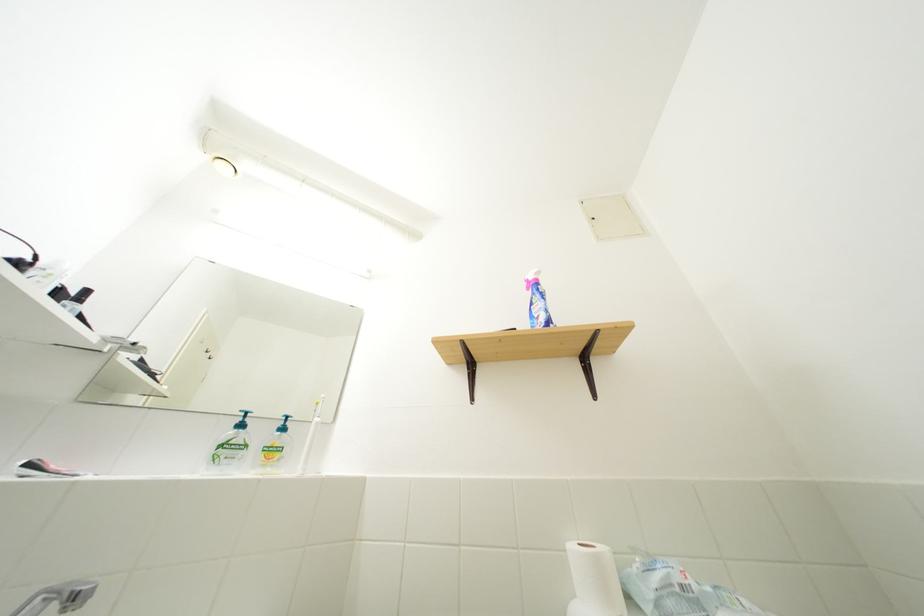
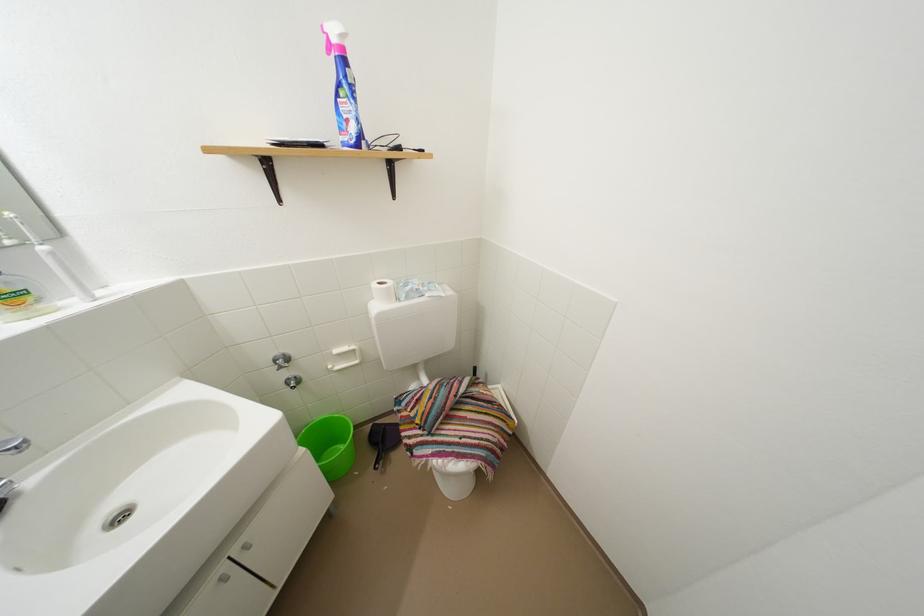
In the second image, find the point that corresponds to point 540,285 in the first image.

(342, 45)